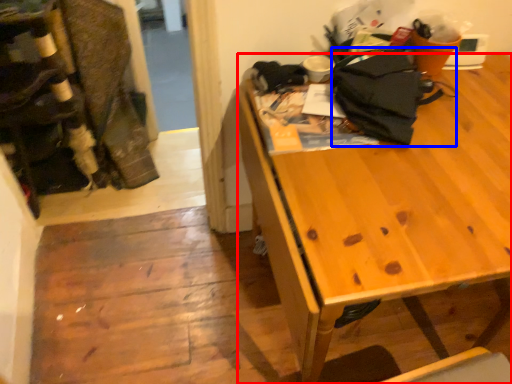
Question: Among these objects, which one is nearest to the camera, desk (highlighted by a red box) or clothing (highlighted by a blue box)?

Choices:
 (A) desk
 (B) clothing

Answer: (A)